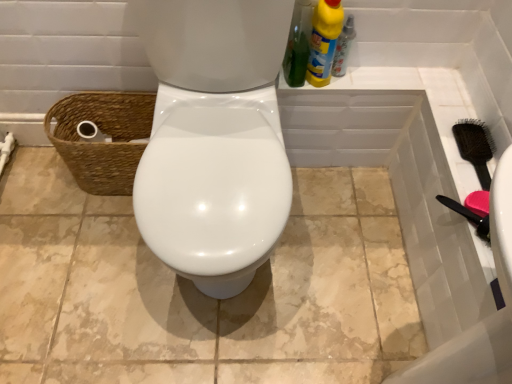
Where is `free point behind black plastic brush at right`? This screenshot has height=384, width=512. free point behind black plastic brush at right is located at coordinates (449, 100).